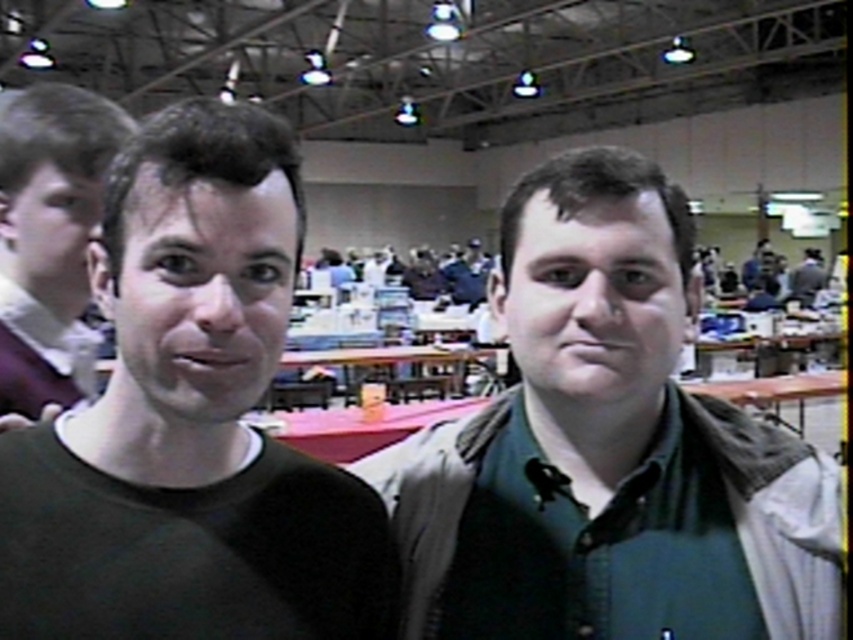
Question: Which point appears farthest from the camera in this image?

Choices:
 (A) (498, 314)
 (B) (212, 317)

Answer: (A)

Question: Is black matte shirt at left further to camera compared to green matte face at center?

Choices:
 (A) no
 (B) yes

Answer: (A)

Question: Which of the following is the closest to the observer?

Choices:
 (A) green matte face at center
 (B) green matte jacket at center
 (C) black matte shirt at left
 (D) smooth skin face at upper left

Answer: (C)

Question: Which of the following is the farthest from the observer?

Choices:
 (A) matte black shirt at left
 (B) black matte shirt at left
 (C) green matte jacket at center
 (D) green matte face at center

Answer: (A)

Question: Is black matte shirt at left to the right of smooth skin face at upper left from the viewer's perspective?

Choices:
 (A) no
 (B) yes

Answer: (B)

Question: Is matte black face at left to the left of smooth skin face at upper left from the viewer's perspective?

Choices:
 (A) no
 (B) yes

Answer: (A)